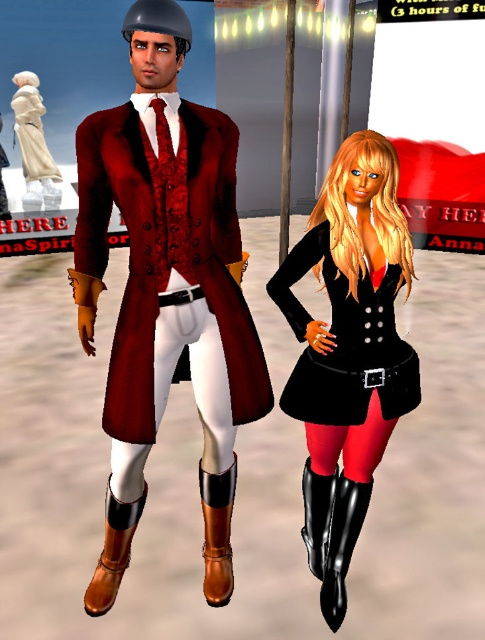
Looking at this image, who is more forward, (130, 58) or (336, 276)?

Point (130, 58) is more forward.

Which is more to the right, shiny leather coat at center or black satin dress at center?

black satin dress at center is more to the right.

Between point (233, 141) and point (288, 308), which one is positioned in front?

Positioned in front is point (233, 141).

The width and height of the screenshot is (485, 640). I want to click on shiny leather coat at center, so click(166, 289).

Can you confirm if white leather pants at center is positioned to the left of black leather boot at lower center?

Yes, white leather pants at center is to the left of black leather boot at lower center.

Who is more distant from viewer, (223, 388) or (324, 563)?

The point (324, 563) is behind.

Find the location of `white leather pants at center`. white leather pants at center is located at coordinates (196, 376).

Can you confirm if shiny leather coat at center is taller than black leather boot at lower right?

Correct, shiny leather coat at center is much taller as black leather boot at lower right.

Is shiny leather coat at center further to the viewer compared to black leather boot at lower right?

No, shiny leather coat at center is in front of black leather boot at lower right.

Does point (216, 564) lie in front of point (317, 552)?

Yes, point (216, 564) is in front of point (317, 552).

At what (x,y) coordinates should I click in order to perform the action: click on shiny leather coat at center. Please return your answer as a coordinate pair (x, y). This screenshot has height=640, width=485. Looking at the image, I should click on (166, 289).